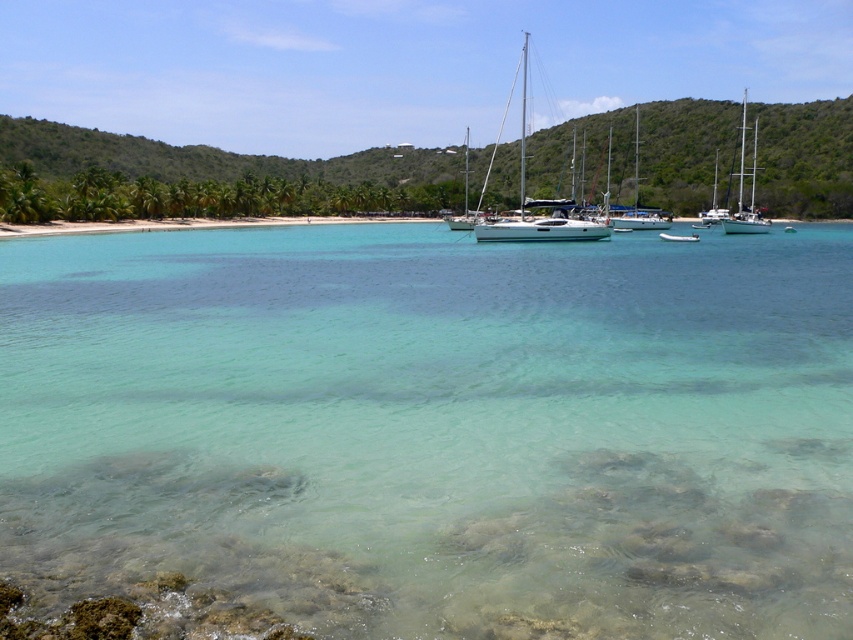
Who is shorter, clear water at center or white glossy sailboat at upper center?

clear water at center

Who is more distant from viewer, (511, 604) or (636, 192)?

Positioned behind is point (636, 192).

Image resolution: width=853 pixels, height=640 pixels. I want to click on clear water at center, so click(436, 428).

Can you confirm if clear water at center is smaller than white glossy sailboat at center?

Correct, clear water at center occupies less space than white glossy sailboat at center.

Can you confirm if clear water at center is shorter than white glossy sailboat at center?

Yes.

Which is behind, point (300, 449) or point (554, 212)?

Point (554, 212)

Find the location of a particular element. clear water at center is located at coordinates (436, 428).

Is point (749, 209) positioned in front of point (692, 240)?

That is False.

You are a GUI agent. You are given a task and a screenshot of the screen. Output one action in this format:
    pyautogui.click(x=<x>, y=<y>)
    Task: Click on the white glossy sailboat at upper right
    
    Given the screenshot: What is the action you would take?
    pyautogui.click(x=741, y=189)

Which is in front, point (749, 209) or point (659, 234)?

Positioned in front is point (659, 234).

Find the location of a particular element. The width and height of the screenshot is (853, 640). white glossy sailboat at upper right is located at coordinates (741, 189).